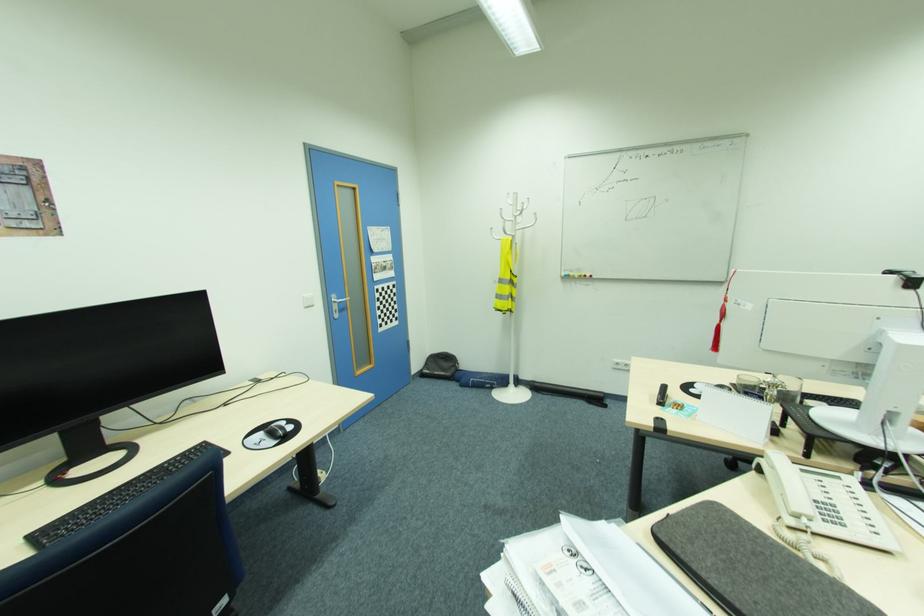
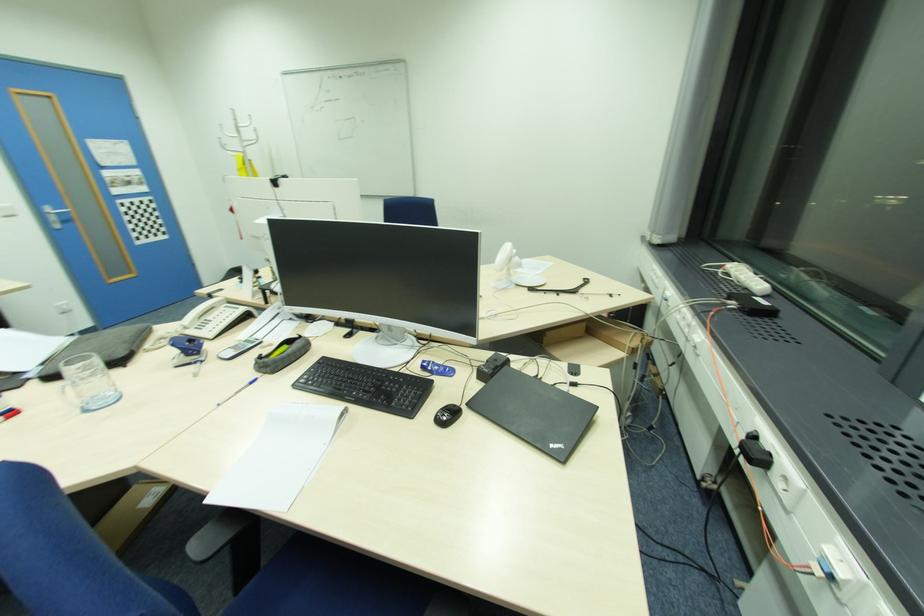
The images are taken continuously from a first-person perspective. In which direction are you moving?

The cameraman walked toward right, backward.